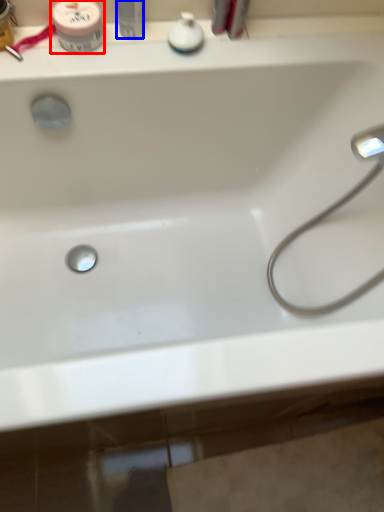
Question: Which point is closer to the camera, mouthwash (highlighted by a red box) or toiletry (highlighted by a blue box)?

Choices:
 (A) mouthwash
 (B) toiletry

Answer: (B)